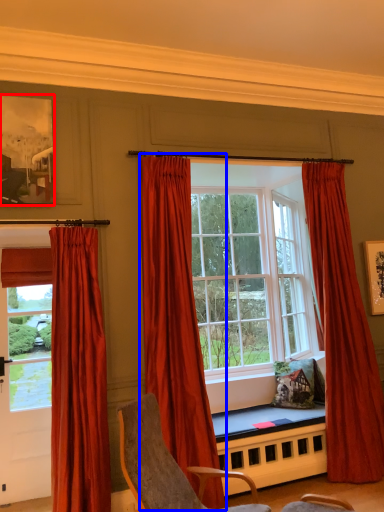
Question: Which of the following is the closest to the observer, picture frame (highlighted by a red box) or curtain (highlighted by a blue box)?

Choices:
 (A) picture frame
 (B) curtain

Answer: (B)